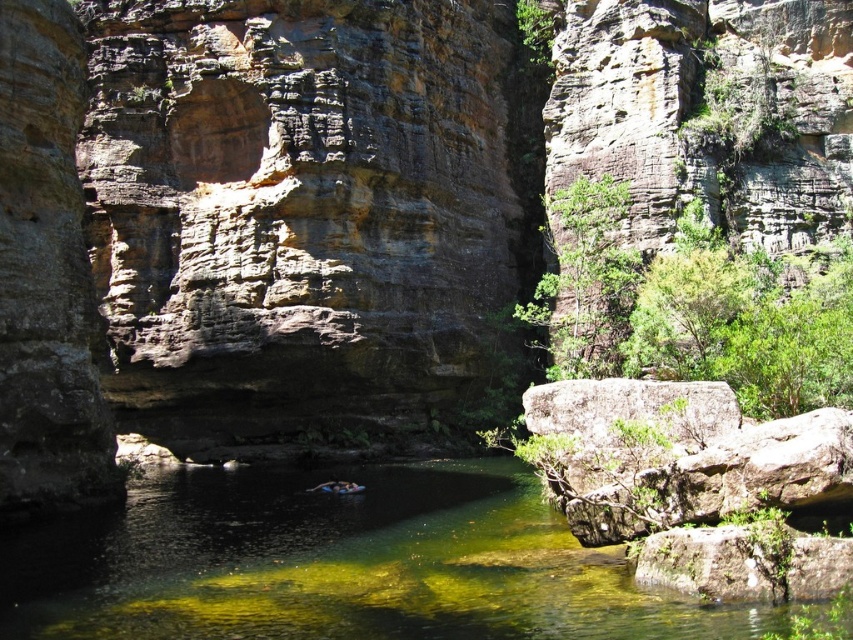
Who is shorter, clear water at center or blue rubber ring at center?

blue rubber ring at center is shorter.

Is clear water at center smaller than blue rubber ring at center?

No.

Is point (514, 556) positioned after point (339, 484)?

No, (514, 556) is closer to viewer.

Identify the location of clear water at center. (338, 564).